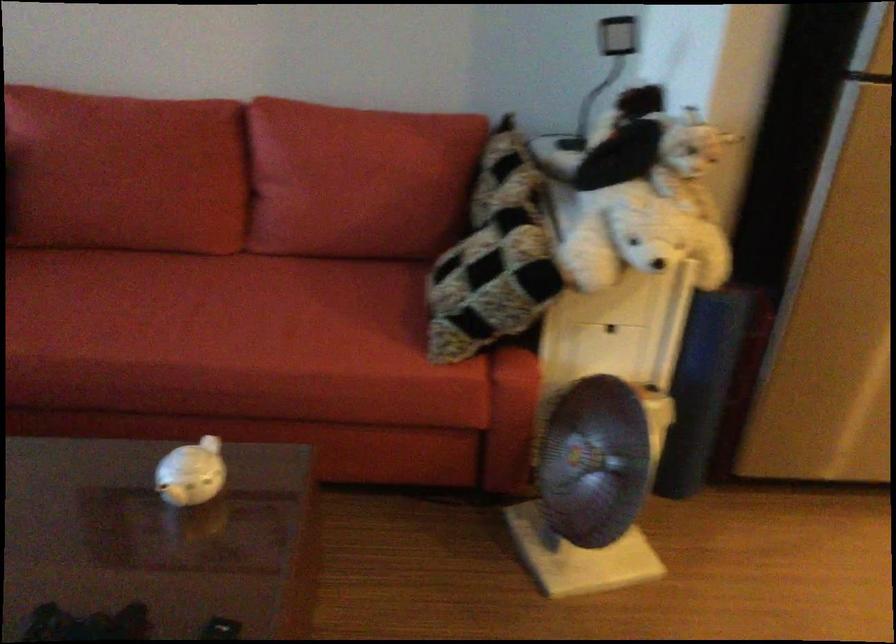
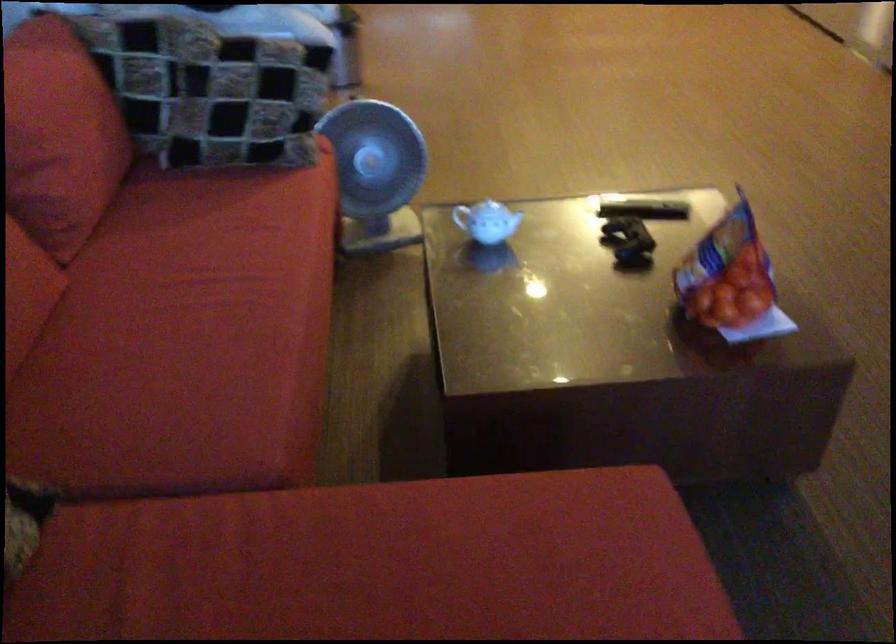
Where in the second image is the point corresponding to point 115,301 from the first image?

(192, 330)